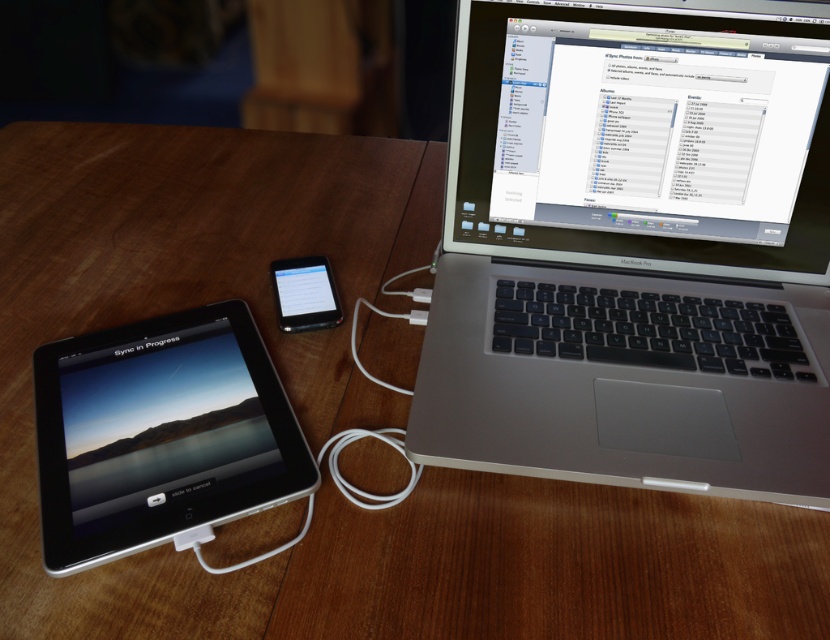
Question: Among these objects, which one is farthest from the camera?

Choices:
 (A) silver/black plastic laptop at right
 (B) satin black ipod at center

Answer: (B)

Question: Considering the real-world distances, which object is closest to the silver/black plastic laptop at right?

Choices:
 (A) black glossy tablet at lower left
 (B) satin black ipod at center

Answer: (B)

Question: Observing the image, what is the correct spatial positioning of black glossy tablet at lower left in reference to satin black ipod at center?

Choices:
 (A) right
 (B) left

Answer: (B)

Question: Is silver/black plastic laptop at right bigger than black glossy tablet at lower left?

Choices:
 (A) no
 (B) yes

Answer: (B)

Question: Where is silver/black plastic laptop at right located in relation to satin black ipod at center in the image?

Choices:
 (A) right
 (B) left

Answer: (A)

Question: Which of the following is the farthest from the observer?

Choices:
 (A) silver/black plastic laptop at right
 (B) black glossy tablet at lower left

Answer: (A)